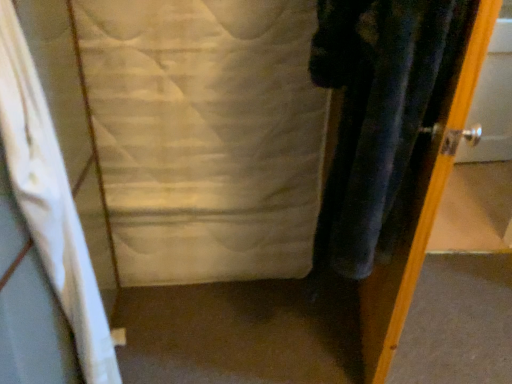
This screenshot has width=512, height=384. What are the coordinates of `vacant area that lies to the right of metallic silver door at right` in the screenshot? It's located at (452, 318).